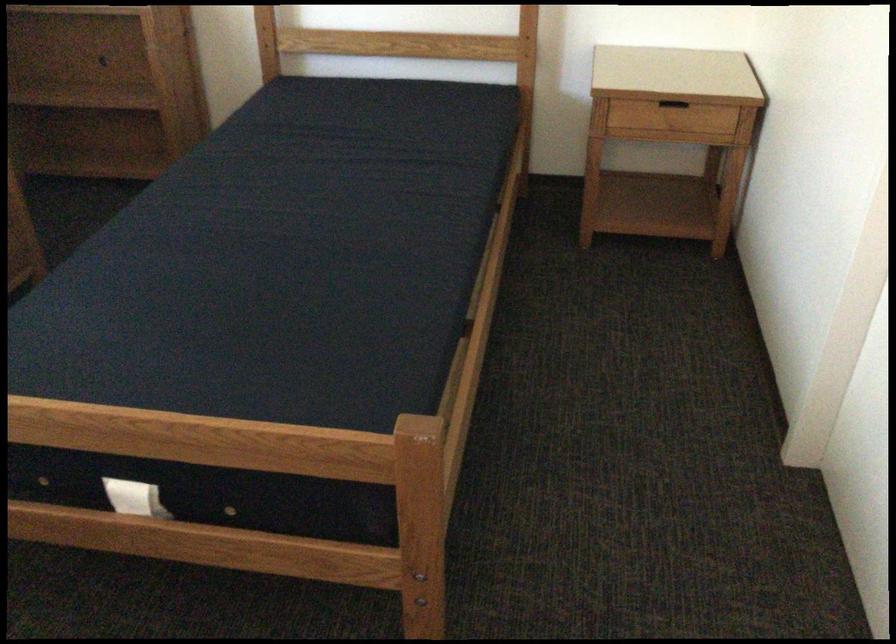
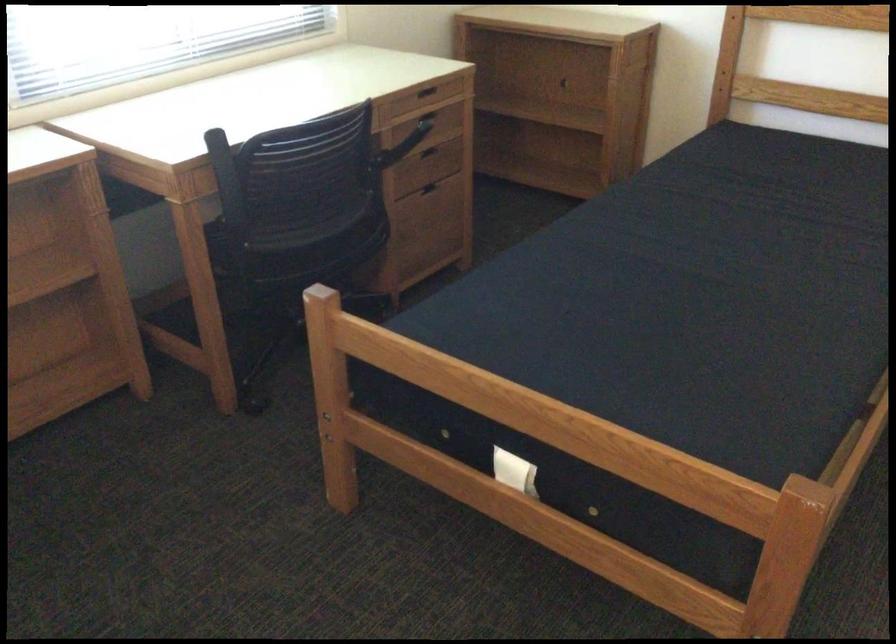
What movement of the cameraman would produce the second image?

The cameraman moved toward left, backward.